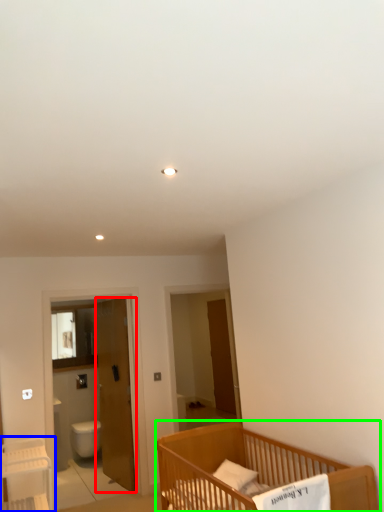
Question: Which object is positioned farthest from door (highlighted by a red box)? Select from table (highlighted by a blue box) and infant bed (highlighted by a green box).

Choices:
 (A) table
 (B) infant bed

Answer: (B)